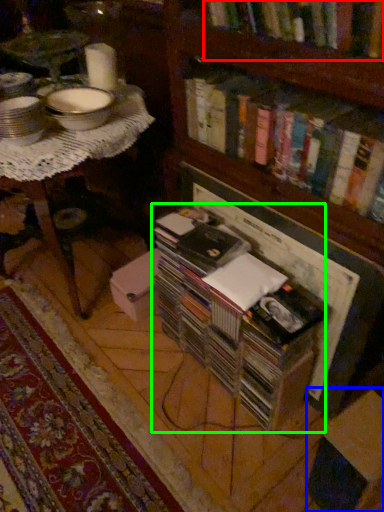
Question: Estimate the real-world distances between objects in this image. Which object is farther from book (highlighted by a red box), cardboard box (highlighted by a blue box) or book (highlighted by a green box)?

Choices:
 (A) cardboard box
 (B) book

Answer: (A)